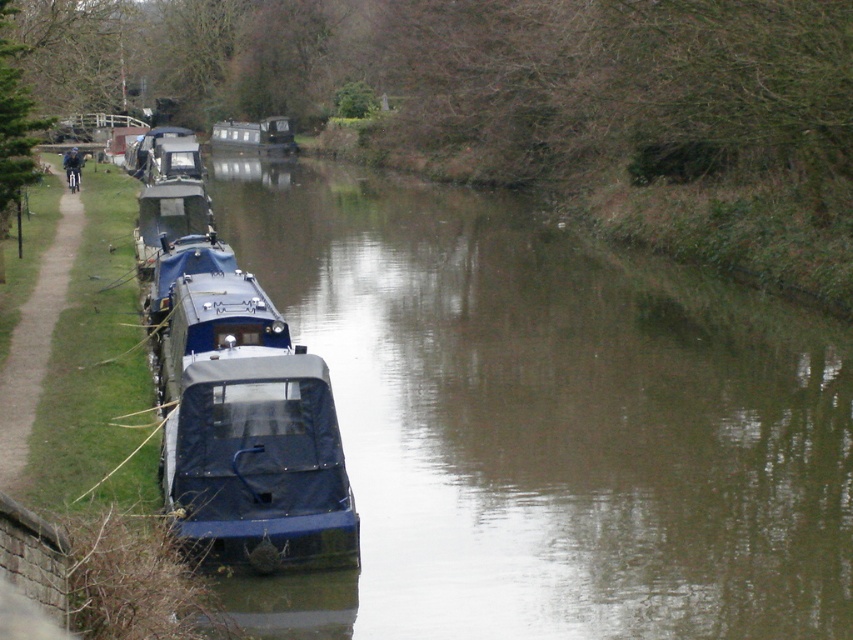
Which is below, blue rubber boat at left or blue matte boat at center?

blue rubber boat at left is below.

Can you confirm if blue rubber boat at left is positioned to the right of blue matte boat at center?

Correct, you'll find blue rubber boat at left to the right of blue matte boat at center.

Between point (381, 243) and point (242, 122), which one is positioned in front?

Point (381, 243) is more forward.

Where is `blue rubber boat at left`? blue rubber boat at left is located at coordinates (547, 422).